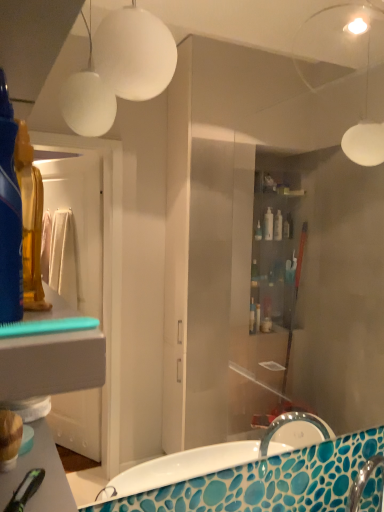
Question: Should I look upward or downward to see translucent plastic mouthwash at left?

Choices:
 (A) up
 (B) down

Answer: (A)